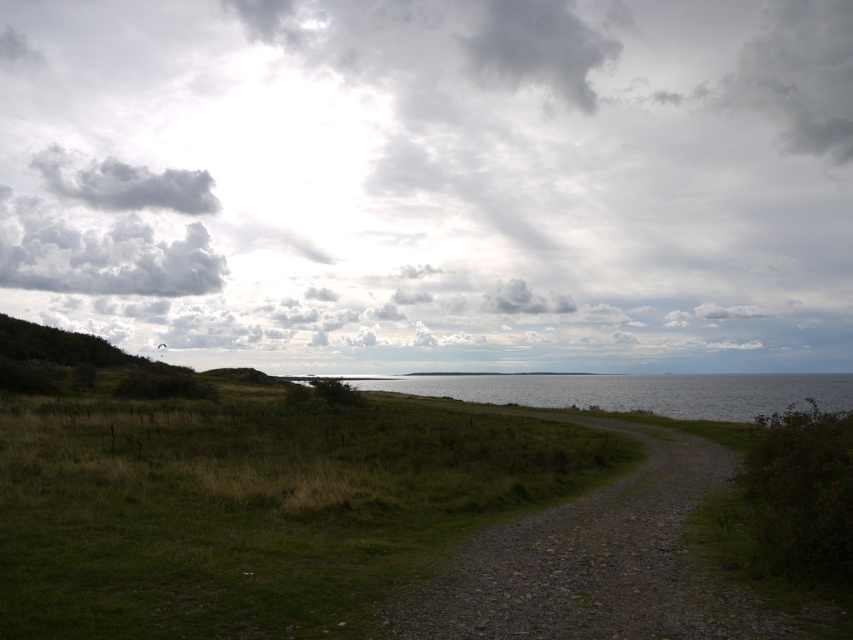
Does clear water at center have a smaller size compared to cloudy white cloud at upper left?

No, clear water at center is not smaller than cloudy white cloud at upper left.

Who is more forward, (791, 392) or (202, 269)?

Point (791, 392)

This screenshot has width=853, height=640. In order to click on clear water at center in this screenshot , I will do `click(634, 392)`.

Is cloudy white cloud at upper left taller than gray fluffy cloud at upper center?

Yes, cloudy white cloud at upper left is taller than gray fluffy cloud at upper center.

From the picture: Who is lower down, cloudy white cloud at upper left or gray fluffy cloud at upper center?

cloudy white cloud at upper left

Who is more forward, (15,266) or (532,10)?

Point (532,10) is more forward.

At what (x,y) coordinates should I click in order to perform the action: click on cloudy white cloud at upper left. Please return your answer as a coordinate pair (x, y). Image resolution: width=853 pixels, height=640 pixels. Looking at the image, I should click on (100, 253).

Can you confirm if clear water at center is wider than gray fluffy cloud at upper center?

Indeed, clear water at center has a greater width compared to gray fluffy cloud at upper center.

The image size is (853, 640). Describe the element at coordinates (634, 392) in the screenshot. I see `clear water at center` at that location.

I want to click on clear water at center, so click(x=634, y=392).

The width and height of the screenshot is (853, 640). Identify the location of clear water at center. (634, 392).